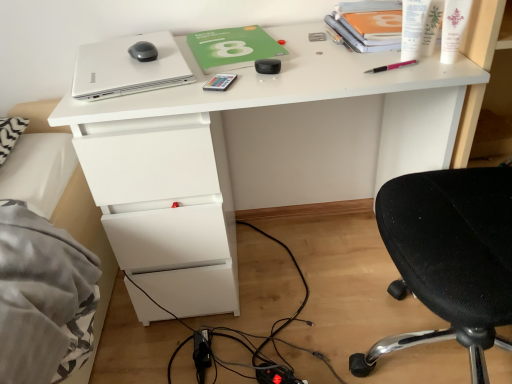
The height and width of the screenshot is (384, 512). In order to click on free space to the left of matte black mouse at upper left in this screenshot , I will do `click(100, 59)`.